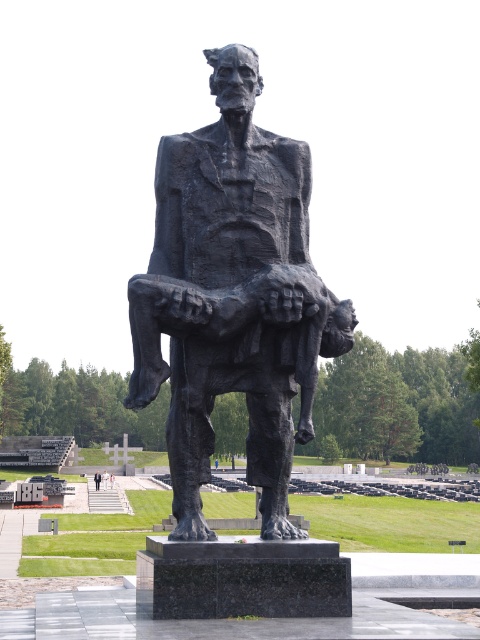
You are standing in front of the statue and want to place a wreath at the base. The coordinates for the statue base are point [285,316] and point [109,474]. Which coordinate should you aim for to place the wreath closest to the front of the statue?

Point [285,316] is in front of point [109,474], so you should aim for point [285,316] to place the wreath closest to the front of the statue.

In the scene shown: You are a photographer standing at the camera position. You want to take a photo of the light brown wooden person at center. Since your camera can only focus on objects within 50 meters, will you be able to capture a clear image?

The light brown wooden person at center is 91.51 meters from camera, which is beyond the camera focus range of 50 meters. Therefore, the camera cannot capture a clear image.

In the scene shown: You are a photographer trying to capture a closeup of the light brown wooden person at center and the white glossy person at center in the statue. Your camera can only focus on objects within a 24 inch range. Can you fit both subjects within the camera focus range?

The distance between the light brown wooden person at center and the white glossy person at center is 26.32 inches, which exceeds the camera focus range of 24 inches. Therefore, both subjects cannot be captured in focus simultaneously.